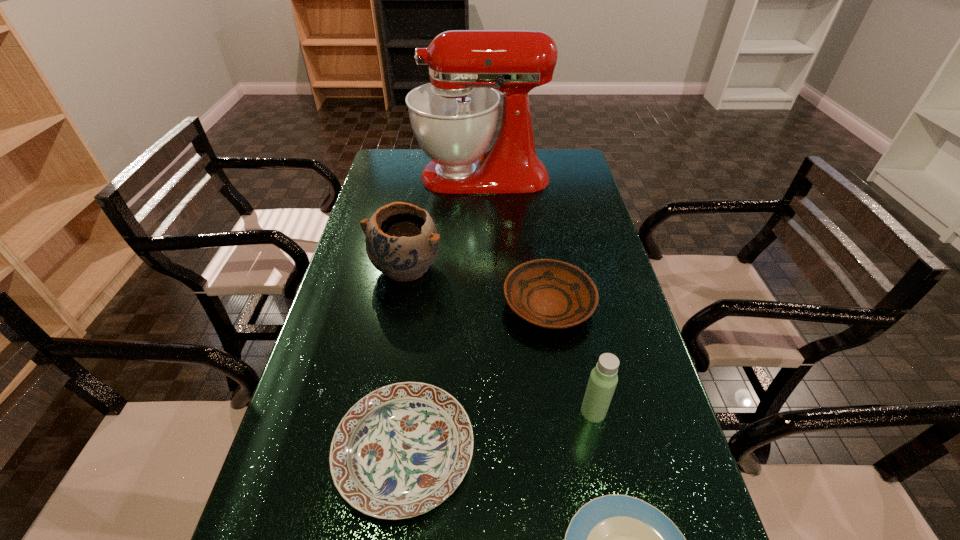
Identify the location of the tallest object. This screenshot has height=540, width=960. (454, 117).

At what (x,y) coordinates should I click in order to perform the action: click on mixer. Please return your answer as a coordinate pair (x, y). The width and height of the screenshot is (960, 540). Looking at the image, I should click on (454, 117).

At what (x,y) coordinates should I click in order to perform the action: click on pottery. Please return your answer as a coordinate pair (x, y). Looking at the image, I should click on (402, 241).

The height and width of the screenshot is (540, 960). I want to click on thermos bottle, so click(603, 379).

Identify the location of the farthest plate. (548, 293).

Locate an element on the screen. This screenshot has width=960, height=540. the tallest plate is located at coordinates (548, 293).

In order to click on the second shortest object in this screenshot , I will do `click(400, 451)`.

This screenshot has width=960, height=540. In order to click on the second tallest plate in this screenshot , I will do `click(400, 451)`.

I want to click on free point located 0.090m at the attachment hub of the mixer, so click(x=392, y=176).

The width and height of the screenshot is (960, 540). I want to click on free spot located at the attachment hub of the mixer, so click(379, 176).